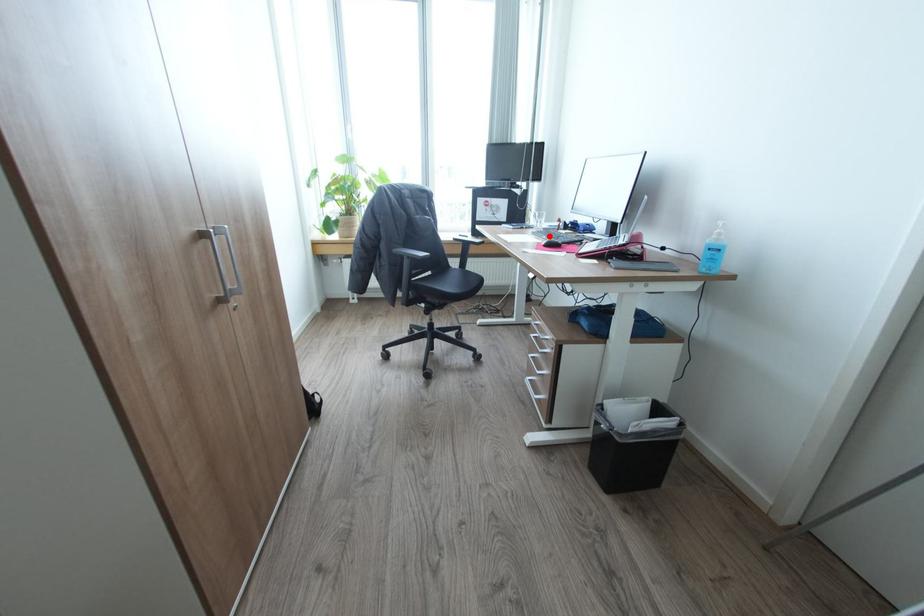
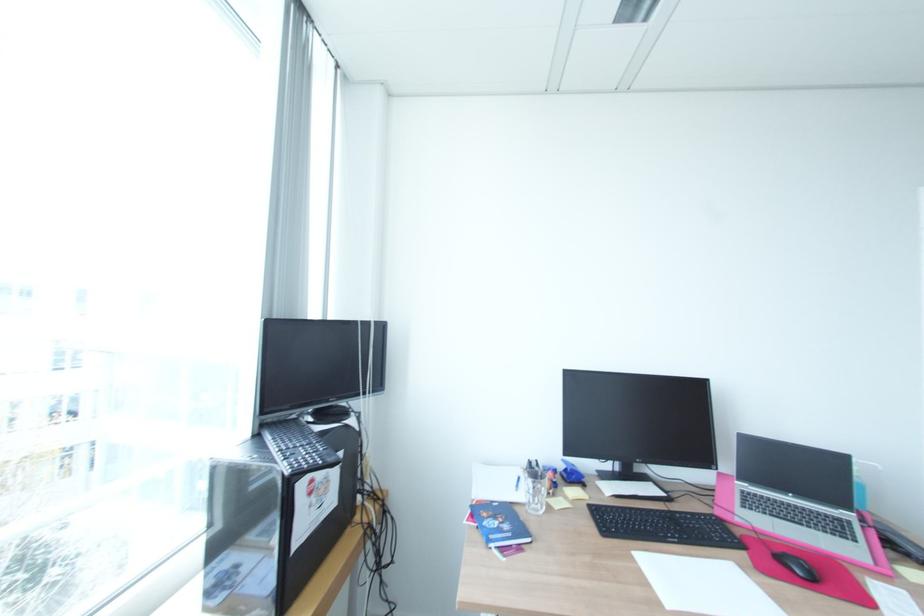
Where in the second image is the point corresponding to the highlighted location from the first image?

(681, 541)